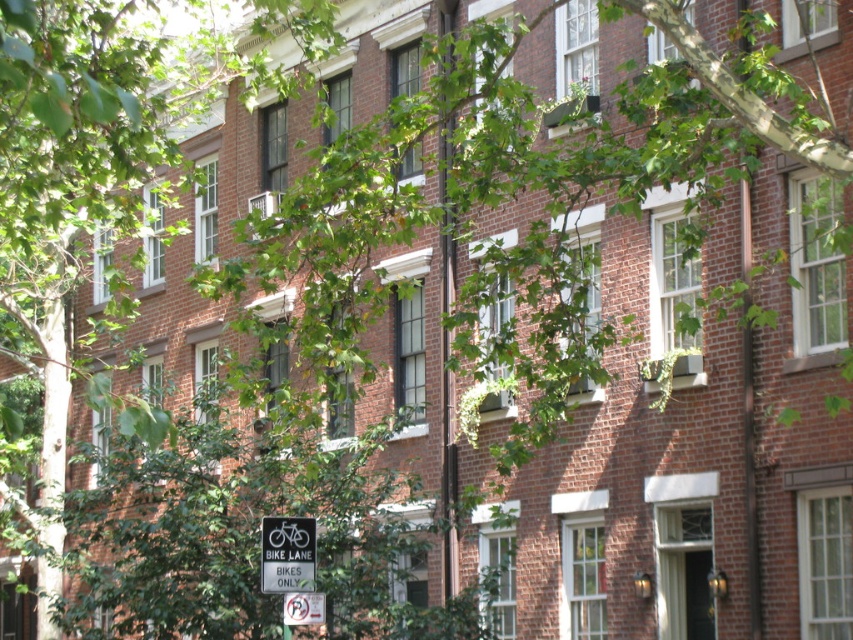
Question: Is white plastic sign at lower left thinner than white paper sign at lower center?

Choices:
 (A) no
 (B) yes

Answer: (A)

Question: Which of the following is the closest to the observer?

Choices:
 (A) (297, 525)
 (B) (312, 621)

Answer: (B)

Question: Can you confirm if white plastic sign at lower left is thinner than white paper sign at lower center?

Choices:
 (A) yes
 (B) no

Answer: (B)

Question: Is white plastic sign at lower left behind white paper sign at lower center?

Choices:
 (A) yes
 (B) no

Answer: (B)